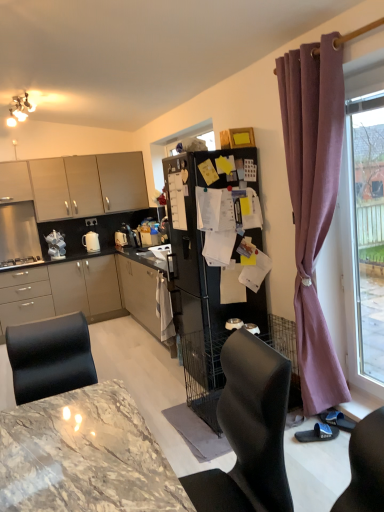
Question: Considering the relative positions of white glossy kettle at left, which ranks as the 2th appliance in left-to-right order, and matte gray cabinets at left, which is the first cabinetry from bottom to top, in the image provided, is white glossy kettle at left, which ranks as the 2th appliance in left-to-right order, to the left of matte gray cabinets at left, which is the first cabinetry from bottom to top, from the viewer's perspective?

Choices:
 (A) no
 (B) yes

Answer: (B)

Question: Can you confirm if white glossy kettle at left, the second appliance positioned from the right, is thinner than matte gray cabinets at left, which is the first cabinetry from bottom to top?

Choices:
 (A) no
 (B) yes

Answer: (B)

Question: Is white glossy kettle at left, which ranks as the 2th appliance in left-to-right order, closer to camera compared to matte gray cabinets at left, the third cabinetry positioned from the top?

Choices:
 (A) no
 (B) yes

Answer: (A)

Question: Could you tell me if white glossy kettle at left, the second appliance positioned from the right, is facing matte gray cabinets at left, the third cabinetry positioned from the top?

Choices:
 (A) no
 (B) yes

Answer: (A)

Question: Is white glossy kettle at left, which ranks as the 2th appliance in left-to-right order, facing away from matte gray cabinets at left, the third cabinetry positioned from the top?

Choices:
 (A) yes
 (B) no

Answer: (B)

Question: Considering their positions, is white glossy electric kettle at center, which is the 1th appliance from right to left, located in front of or behind black matte refrigerator at center?

Choices:
 (A) front
 (B) behind

Answer: (B)

Question: In the image, is white glossy electric kettle at center, which is the 1th appliance from right to left, on the left side or the right side of black matte refrigerator at center?

Choices:
 (A) right
 (B) left

Answer: (B)

Question: From a real-world perspective, is white glossy electric kettle at center, which is the third appliance in left-to-right order, above or below black matte refrigerator at center?

Choices:
 (A) above
 (B) below

Answer: (A)

Question: Does point (96, 242) appear closer or farther from the camera than point (188, 280)?

Choices:
 (A) farther
 (B) closer

Answer: (A)

Question: Do you think matte beige cabinets at upper left, which is the first cabinetry from top to bottom, is within white glossy kettle at left, which ranks as the 2th appliance in left-to-right order, or outside of it?

Choices:
 (A) inside
 (B) outside

Answer: (B)

Question: In the image, is matte beige cabinets at upper left, which is the first cabinetry from top to bottom, positioned in front of or behind white glossy kettle at left, the second appliance positioned from the right?

Choices:
 (A) front
 (B) behind

Answer: (A)

Question: Considering the positions of matte beige cabinets at upper left, positioned as the 3th cabinetry in bottom-to-top order, and white glossy kettle at left, the second appliance positioned from the right, in the image, is matte beige cabinets at upper left, positioned as the 3th cabinetry in bottom-to-top order, taller or shorter than white glossy kettle at left, the second appliance positioned from the right,?

Choices:
 (A) short
 (B) tall

Answer: (B)

Question: From the image's perspective, is matte beige cabinets at upper left, which is the first cabinetry from top to bottom, positioned above or below white glossy kettle at left, the second appliance positioned from the right?

Choices:
 (A) below
 (B) above

Answer: (B)

Question: In terms of width, does matte white cabinet at upper left, acting as the 2th cabinetry starting from the bottom, look wider or thinner when compared to pink fabric curtain at right?

Choices:
 (A) thin
 (B) wide

Answer: (B)

Question: Which is correct: matte white cabinet at upper left, the second cabinetry from the top, is inside pink fabric curtain at right, or outside of it?

Choices:
 (A) outside
 (B) inside

Answer: (A)